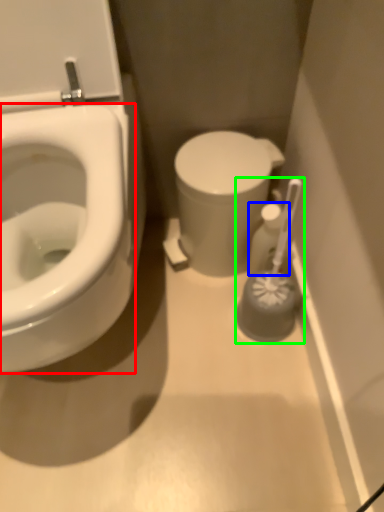
Question: Considering the real-world distances, which object is farthest from bidet (highlighted by a red box)? toiletry (highlighted by a blue box) or brush (highlighted by a green box)?

Choices:
 (A) toiletry
 (B) brush

Answer: (A)